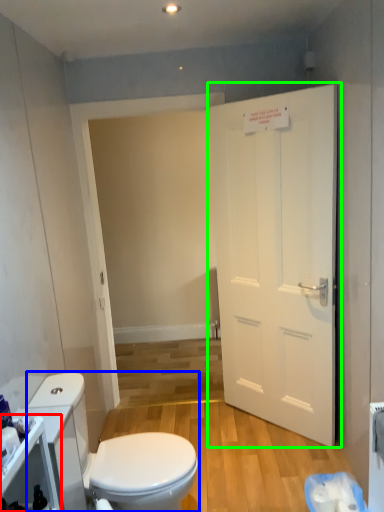
Question: Estimate the real-world distances between objects in this image. Which object is closer to cabinetry (highlighted by a red box), toilet (highlighted by a blue box) or door (highlighted by a green box)?

Choices:
 (A) toilet
 (B) door

Answer: (A)